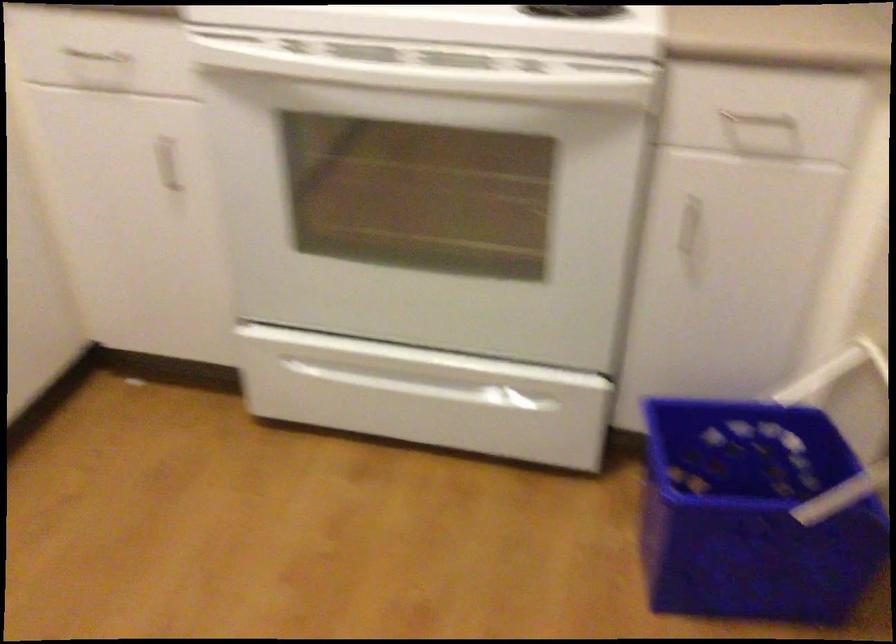
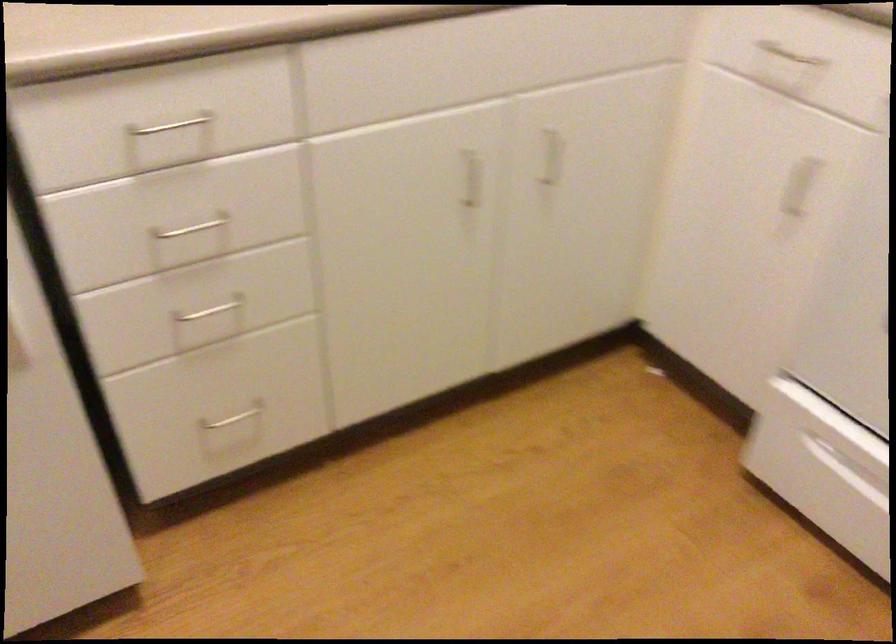
In the second image, find the point that corresponds to pixel 108 69 in the first image.

(789, 55)